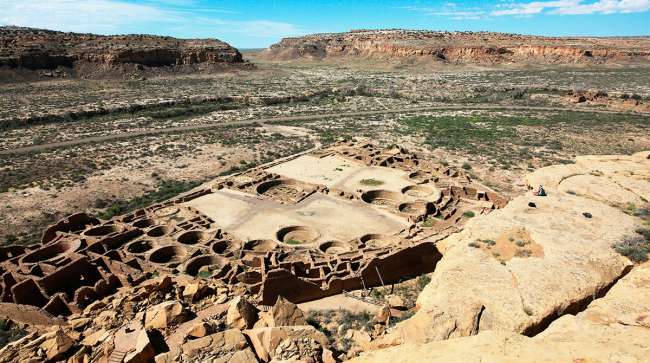
Where is `stairs`? stairs is located at coordinates (112, 356).